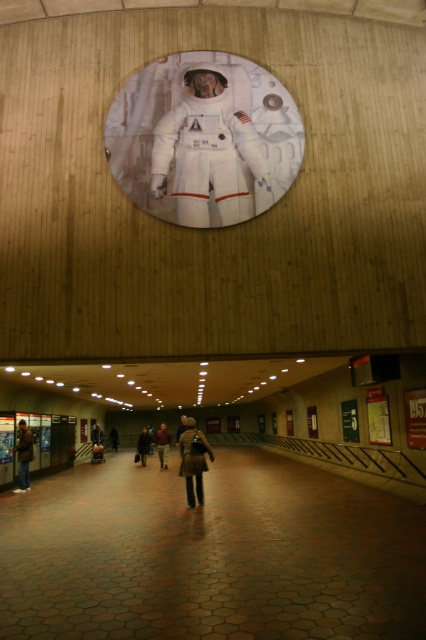
Question: Is brown fabric jacket at center above dark brown leather jacket at center?

Choices:
 (A) yes
 (B) no

Answer: (A)

Question: Is white matte astronaut at upper center to the left of dark brown leather jacket at center from the viewer's perspective?

Choices:
 (A) no
 (B) yes

Answer: (A)

Question: Can you confirm if brown fabric jacket at center is thinner than dark brown leather jacket at center?

Choices:
 (A) yes
 (B) no

Answer: (A)

Question: Which of the following is the closest to the observer?

Choices:
 (A) (32, 436)
 (B) (155, 442)

Answer: (A)

Question: Which object is positioned closest to the brown fabric jacket at center?

Choices:
 (A) brown leather jacket at center
 (B) dark brown leather jacket at center

Answer: (B)

Question: Considering the real-world distances, which object is closest to the brown leather jacket at center?

Choices:
 (A) white matte astronaut at upper center
 (B) brown fabric jacket at center

Answer: (A)